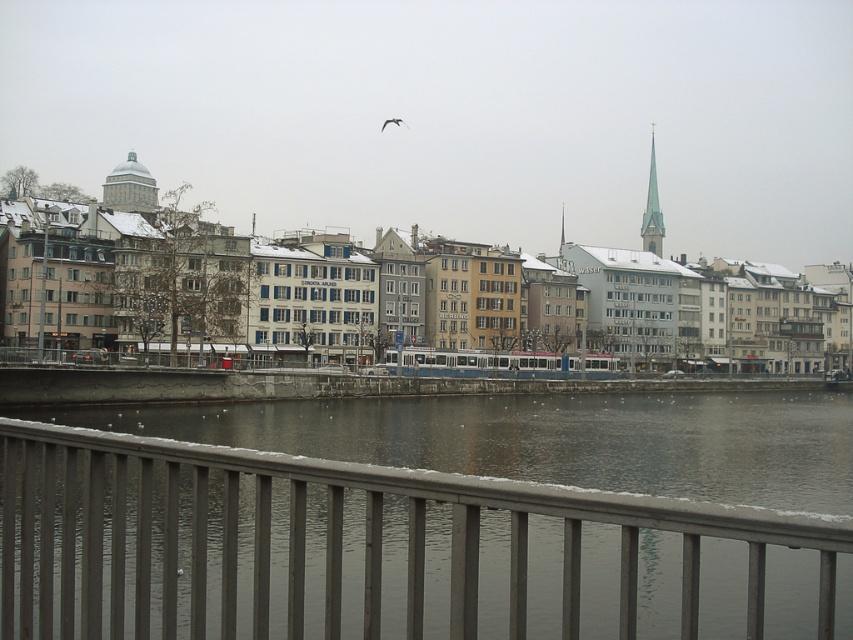
Question: Among these points, which one is farthest from the camera?

Choices:
 (A) (32, 618)
 (B) (650, 166)

Answer: (B)

Question: Is the position of metal/rustic rail at lower center more distant than that of white stone spire at upper right?

Choices:
 (A) no
 (B) yes

Answer: (A)

Question: Which point is farther from the camera taking this photo?

Choices:
 (A) (641, 221)
 (B) (97, 627)

Answer: (A)

Question: Can you confirm if metal/rustic rail at lower center is positioned below white stone spire at upper right?

Choices:
 (A) yes
 (B) no

Answer: (A)

Question: Is metal/rustic rail at lower center behind white stone spire at upper right?

Choices:
 (A) no
 (B) yes

Answer: (A)

Question: Among these objects, which one is nearest to the camera?

Choices:
 (A) white stone spire at upper right
 (B) metal/rustic rail at lower center

Answer: (B)